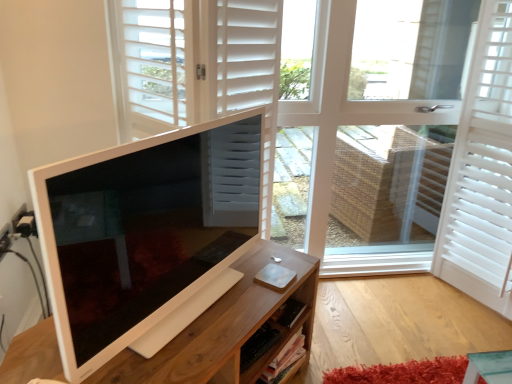
You are a GUI agent. You are given a task and a screenshot of the screen. Output one action in this format:
    pyautogui.click(x=<x>, y=<y>)
    Task: Click on the free space underneath white glossy computer monitor at left (from a real-world perspective)
    
    Given the screenshot: What is the action you would take?
    coord(183,311)